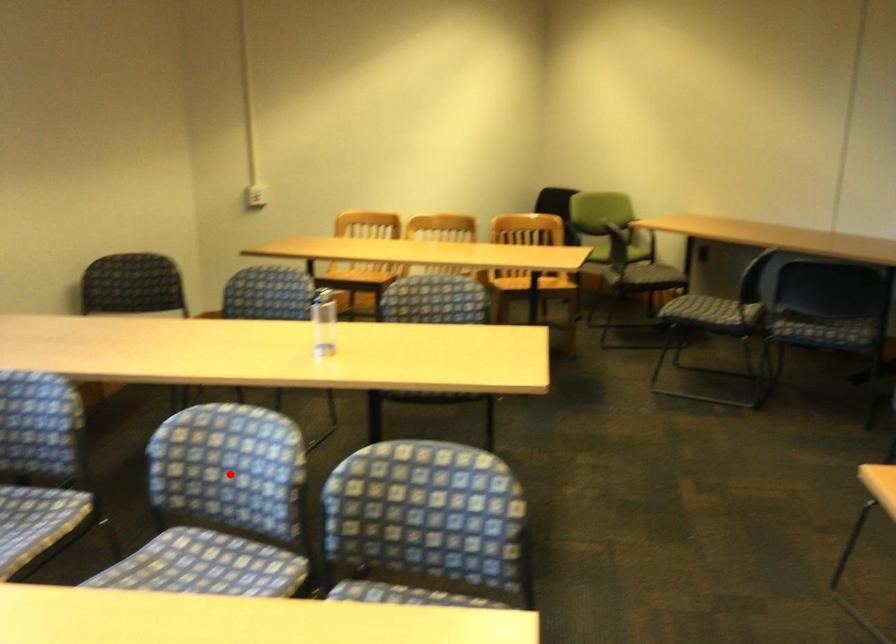
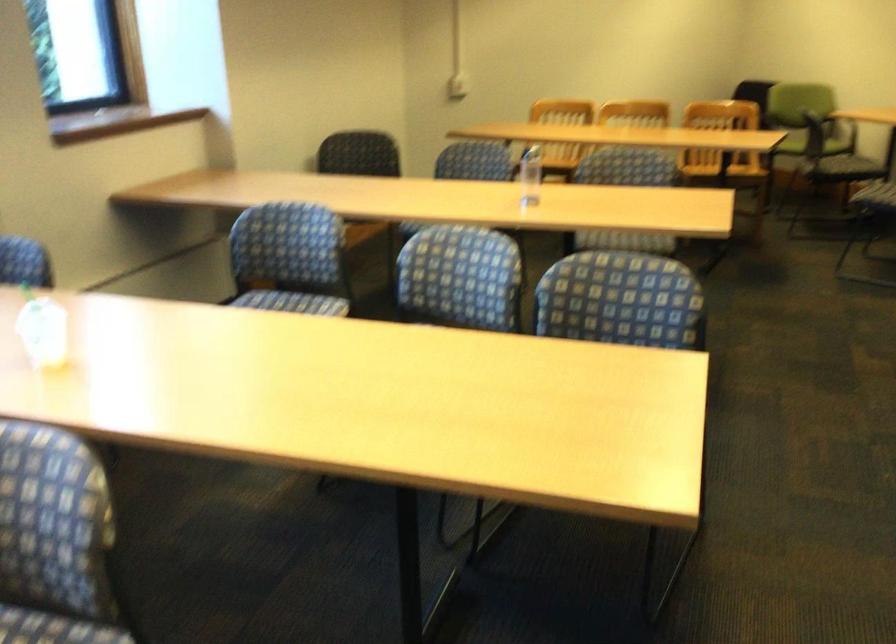
Question: I am providing you with two images of the same scene from different viewpoints. Image1 has a red point marked. In image2, the corresponding 3D location appears at what relative position? Reply with the corresponding letter.

Choices:
 (A) Closer
 (B) Farther

Answer: (B)